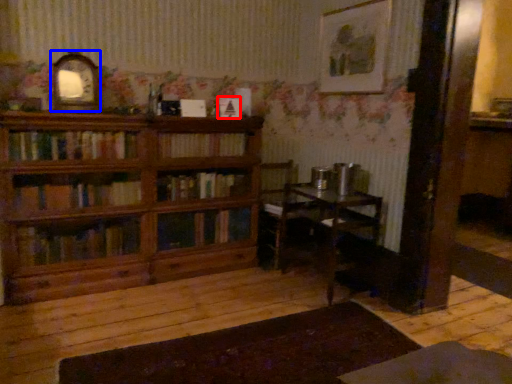
Question: Which object is further to the camera taking this photo, book (highlighted by a red box) or picture frame (highlighted by a blue box)?

Choices:
 (A) book
 (B) picture frame

Answer: (A)